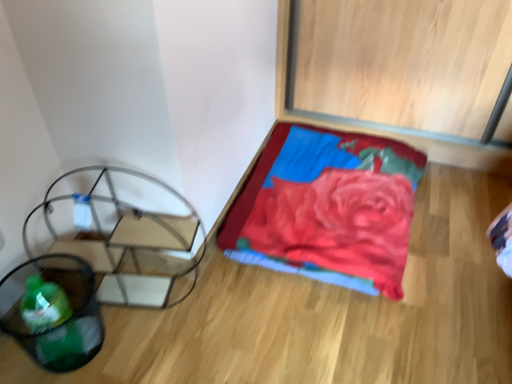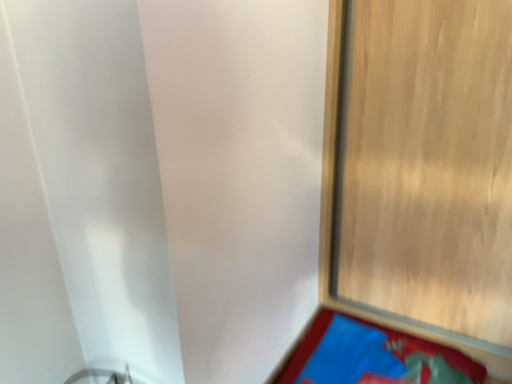
Question: How did the camera likely rotate when shooting the video?

Choices:
 (A) rotated left
 (B) rotated right

Answer: (A)